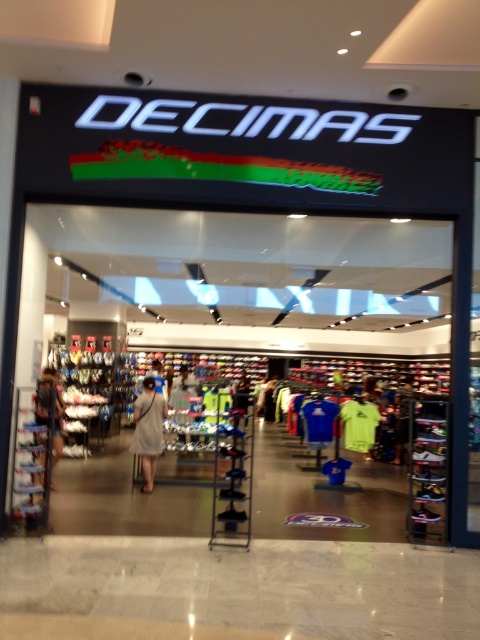
What do you see at coordinates (147, 429) in the screenshot? I see `light beige fabric dress at center` at bounding box center [147, 429].

Does light beige fabric dress at center have a lesser width compared to light gray fabric shirt at center?

Yes.

Who is more distant from viewer, (144, 390) or (396, 456)?

The point (396, 456) is behind.

Locate an element on the screen. This screenshot has width=480, height=640. light beige fabric dress at center is located at coordinates (147, 429).

You are a GUI agent. You are given a task and a screenshot of the screen. Output one action in this format:
    pyautogui.click(x=<x>, y=<y>)
    Task: Click on the light gray fabric dress at left
    
    Given the screenshot: What is the action you would take?
    pyautogui.click(x=49, y=408)

Is point (54, 460) closer to viewer compared to point (400, 387)?

Yes, it is in front of point (400, 387).

Where is `light gray fabric dress at left`? This screenshot has width=480, height=640. light gray fabric dress at left is located at coordinates (49, 408).

The height and width of the screenshot is (640, 480). What are the coordinates of `light gray fabric dress at left` in the screenshot? It's located at (49, 408).

Is light beige fabric dress at center above light gray fabric dress at left?

Incorrect, light beige fabric dress at center is not positioned above light gray fabric dress at left.

Is light beige fabric dress at center to the right of light gray fabric dress at left from the viewer's perspective?

Yes, light beige fabric dress at center is to the right of light gray fabric dress at left.

Is point (134, 435) closer to viewer compared to point (43, 460)?

No.

This screenshot has width=480, height=640. Identify the location of light beige fabric dress at center. (147, 429).